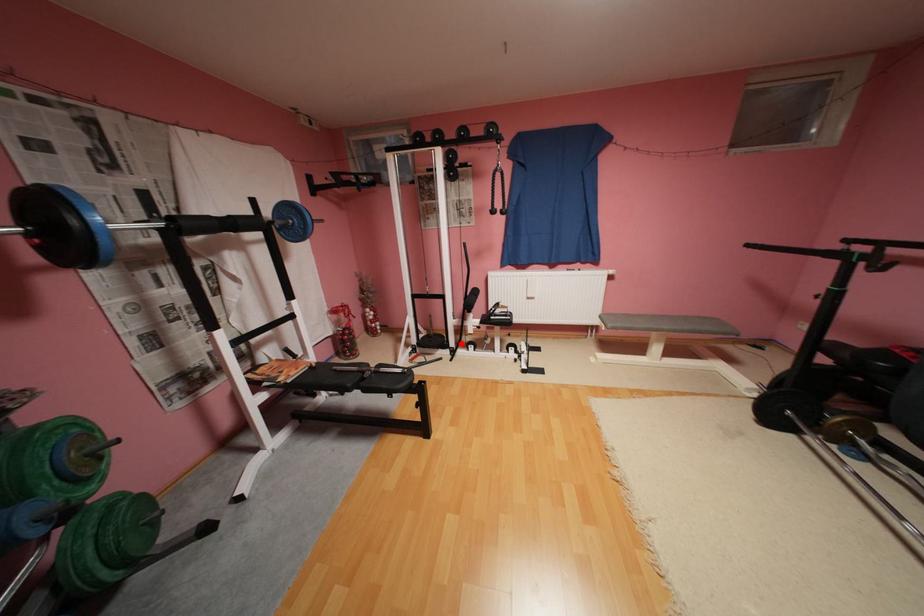
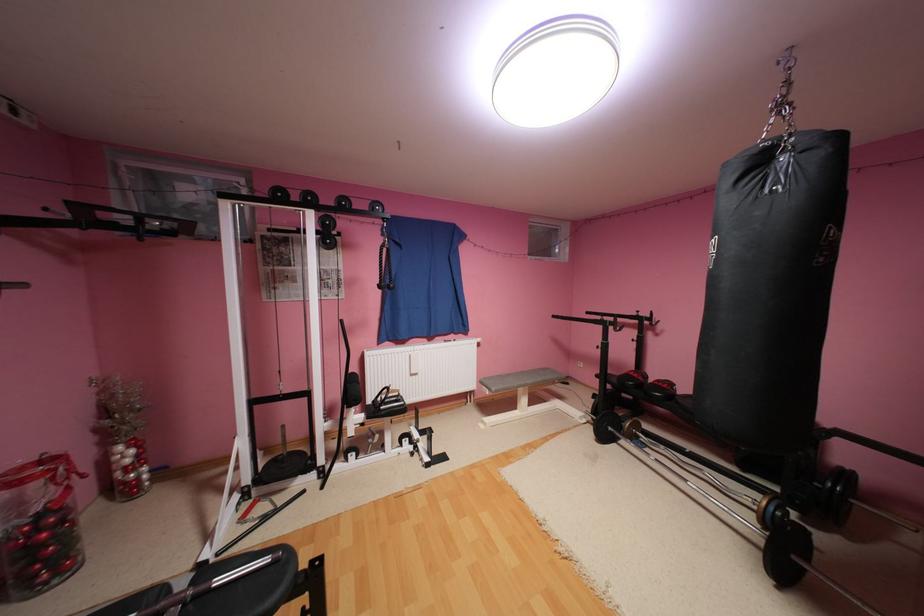
In the second image, find the point that corresponds to the highlighted location in the first image.

(331, 460)